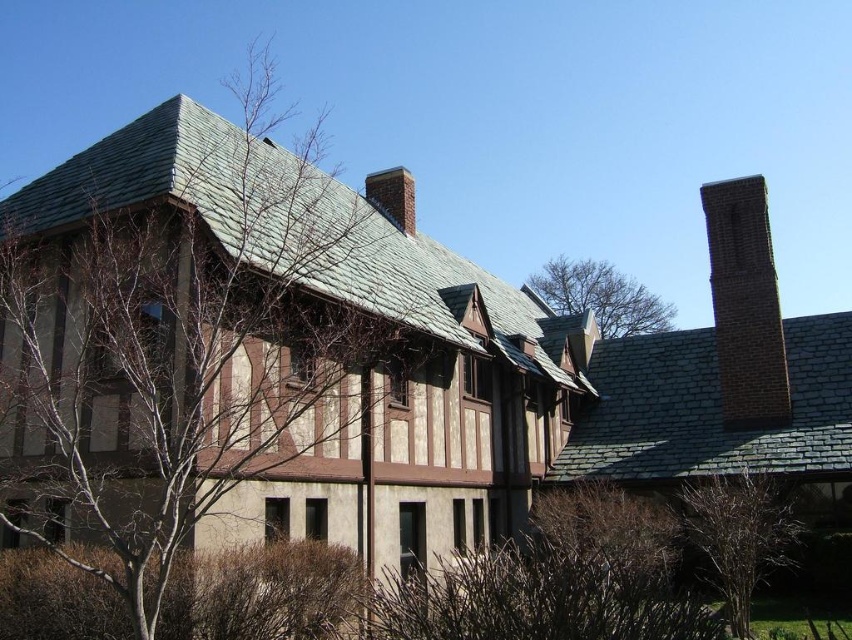
You are standing in front of the building and notice the brick chimney at upper right and the bare branches at upper center. Which object is nearer to you?

The brick chimney at upper right is closer to the viewer than the bare branches at upper center.

You are a drone operator trying to fly a drone between the brick chimney at upper right and the bare branches at upper center. Given that your drone has a maximum flight distance of 300 feet, will it be able to make the trip in one go without recharging?

The brick chimney at upper right and the bare branches at upper center are 313.27 feet apart. Since the drone can only fly 300 feet before needing to recharge, it cannot make the trip in one go without recharging.

You are standing in front of the building and notice a point marked at coordinates (183,340). What can be found at that specific location?

At point (183,340) lies bare branches at left.